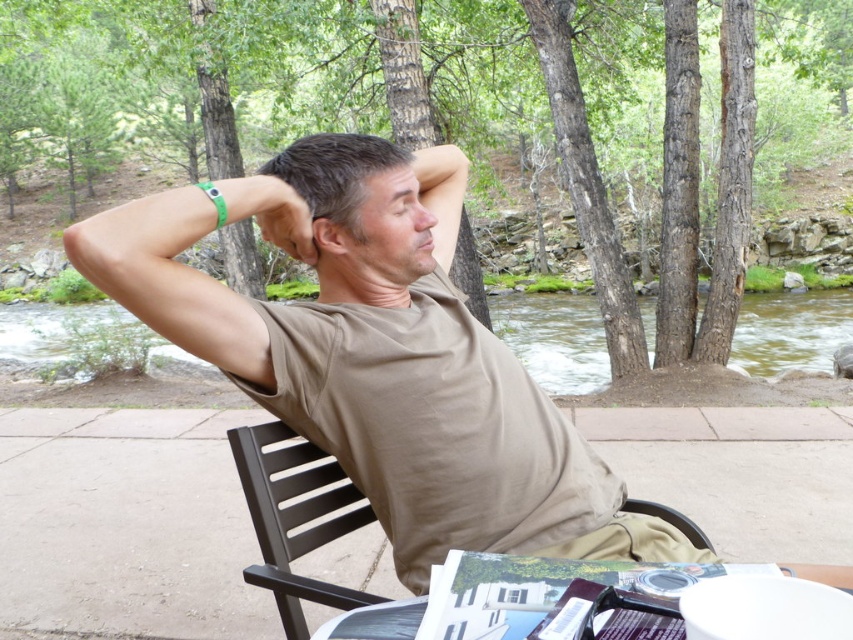
Who is lower down, white paper at lower center or brown plastic chair at center?

brown plastic chair at center

Can you confirm if white paper at lower center is bigger than brown plastic chair at center?

Incorrect, white paper at lower center is not larger than brown plastic chair at center.

At what (x,y) coordinates should I click in order to perform the action: click on white paper at lower center. Please return your answer as a coordinate pair (x, y). The image size is (853, 640). Looking at the image, I should click on (508, 595).

Is brown matte hair at center shorter than brown plastic chair at center?

No, brown matte hair at center is not shorter than brown plastic chair at center.

Based on the photo, between brown matte hair at center and brown plastic chair at center, which one appears on the left side from the viewer's perspective?

brown plastic chair at center

The height and width of the screenshot is (640, 853). What are the coordinates of `brown matte hair at center` in the screenshot? It's located at (372, 212).

The image size is (853, 640). What are the coordinates of `brown matte hair at center` in the screenshot? It's located at (372, 212).

Between point (474, 339) and point (312, 595), which one is positioned behind?

Positioned behind is point (474, 339).

The width and height of the screenshot is (853, 640). Describe the element at coordinates (380, 356) in the screenshot. I see `tan cotton shirt at center` at that location.

The height and width of the screenshot is (640, 853). I want to click on tan cotton shirt at center, so click(x=380, y=356).